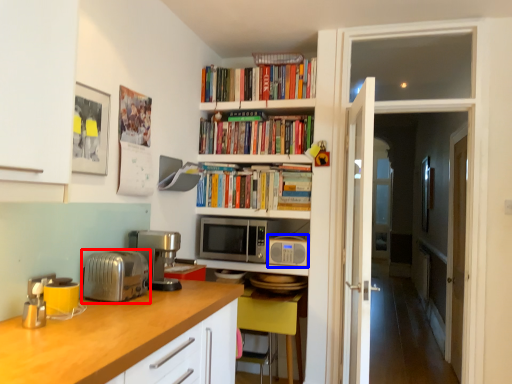
Question: Among these objects, which one is nearest to the camera, toaster (highlighted by a red box) or appliance (highlighted by a blue box)?

Choices:
 (A) toaster
 (B) appliance

Answer: (A)